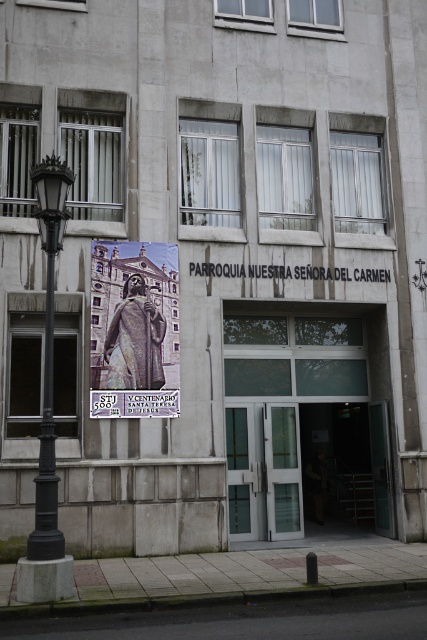
Is point (128, 348) more distant than point (53, 161)?

That is True.

Is matte bronze statue at center behind black cast iron streetlight at left?

Yes, it is behind black cast iron streetlight at left.

Does point (102, 342) come closer to viewer compared to point (55, 541)?

No, it is behind (55, 541).

This screenshot has height=640, width=427. I want to click on matte bronze statue at center, so click(x=134, y=330).